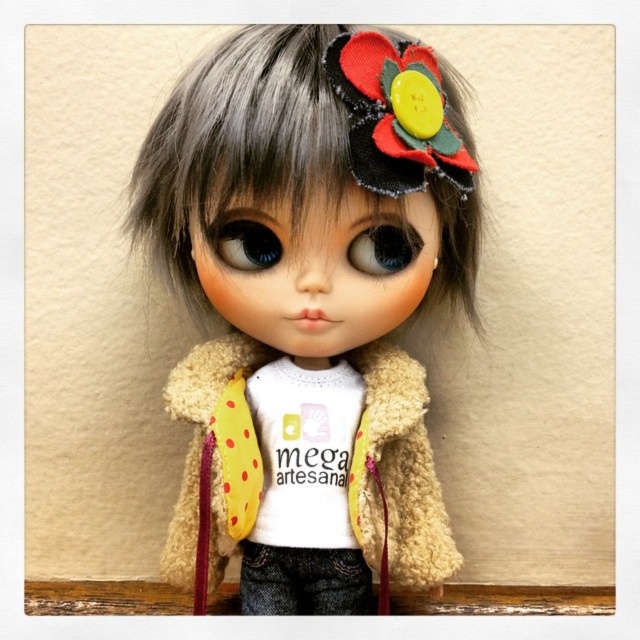
You are a tailor trying to place a new button on the yellow polka dot fabric at center and the wooden ledge at lower center. According to the image, which object should you avoid placing the button on?

You should avoid placing the button on the wooden ledge at lower center because the yellow polka dot fabric at center is to the right of it, meaning the wooden ledge is not the fabric where the button should go.

Please describe the exact location of the fuzzy beige coat at center in the image using coordinates. The coordinates should be in the format of a point with two decimal places, like point 0.5,0.5.

The fuzzy beige coat at center is located at point (308, 307).

You are a tailor measuring materials for a new project. You have a piece of yellow polka dot fabric at center and a wooden ledge at lower center where you want to place it. The fabric needs to be at least 12 inches away from the wooden ledge to avoid wrinkling. Based on the image, will the current placement meet this requirement?

The yellow polka dot fabric at center is only 10.81 inches from the wooden ledge at lower center, which is less than the required 12 inches. Therefore, the current placement does not meet the requirement to avoid wrinkling.